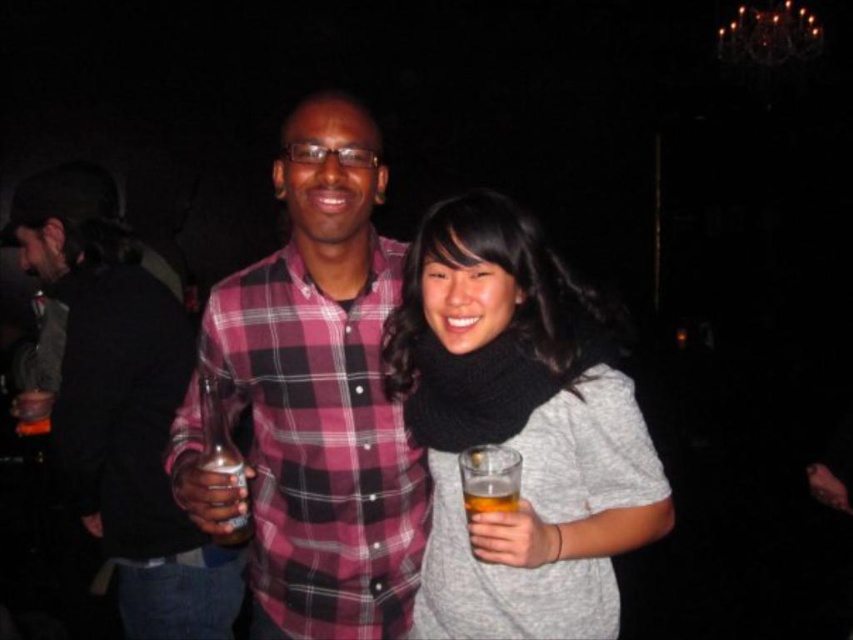
Which of these two, plaid cotton shirt at center or knitted black scarf at center, stands shorter?

knitted black scarf at center is shorter.

Between plaid cotton shirt at center and knitted black scarf at center, which one has more height?

plaid cotton shirt at center

Which is behind, point (328, 282) or point (479, 404)?

The point (328, 282) is more distant.

Where is `plaid cotton shirt at center`? This screenshot has height=640, width=853. plaid cotton shirt at center is located at coordinates (312, 400).

Who is shorter, knitted black scarf at center or plaid fabric shirt at center?

Standing shorter between the two is knitted black scarf at center.

Is knitted black scarf at center bigger than plaid fabric shirt at center?

No.

Is point (465, 390) positioned before point (167, 547)?

Yes.

Find the location of `knitted black scarf at center`. knitted black scarf at center is located at coordinates (517, 429).

What do you see at coordinates (517, 429) in the screenshot?
I see `knitted black scarf at center` at bounding box center [517, 429].

Does knitted black scarf at center have a greater height compared to translucent plastic cup at center?

Yes, knitted black scarf at center is taller than translucent plastic cup at center.

Identify the location of knitted black scarf at center. (517, 429).